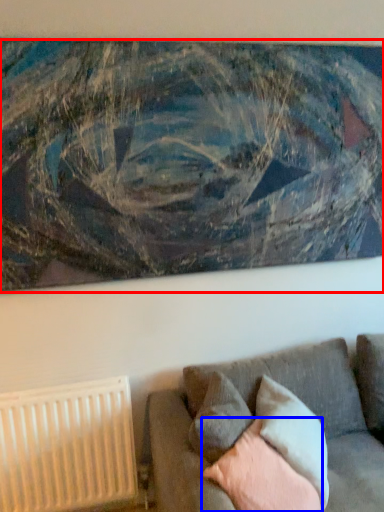
Question: Which object is closer to the camera taking this photo, picture frame (highlighted by a red box) or pillow (highlighted by a blue box)?

Choices:
 (A) picture frame
 (B) pillow

Answer: (B)